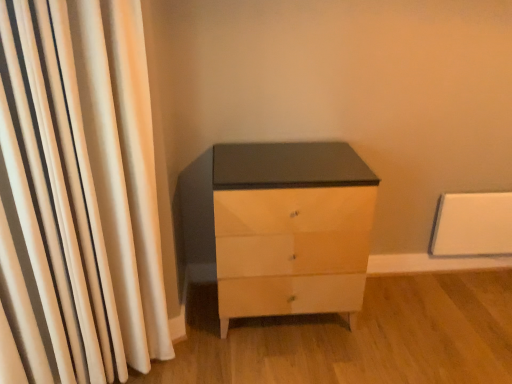
Where is `vacant space in between white fabric curtain at left and matte white chest of drawers at center`? vacant space in between white fabric curtain at left and matte white chest of drawers at center is located at coordinates (227, 344).